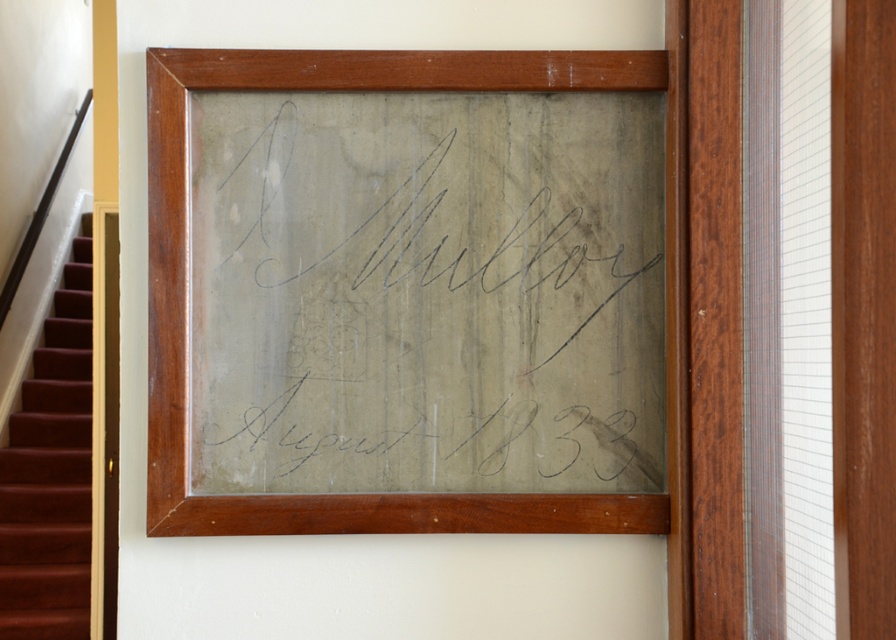
Question: Does matte gray paper at center have a greater width compared to maroon carpeted stairs at left?

Choices:
 (A) yes
 (B) no

Answer: (A)

Question: Does matte gray paper at center appear over maroon carpeted stairs at left?

Choices:
 (A) no
 (B) yes

Answer: (B)

Question: Does matte gray paper at center appear under maroon carpeted stairs at left?

Choices:
 (A) no
 (B) yes

Answer: (A)

Question: Which point appears farthest from the camera in this image?

Choices:
 (A) (263, 348)
 (B) (79, 572)

Answer: (B)

Question: Which point is farther to the camera?

Choices:
 (A) (47, 488)
 (B) (227, 161)

Answer: (A)